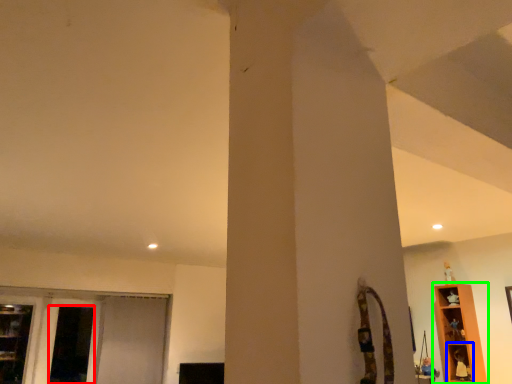
Question: Estimate the real-world distances between objects in this image. Which object is farther from screen door (highlighted by a red box), shelf (highlighted by a blue box) or shelf (highlighted by a green box)?

Choices:
 (A) shelf
 (B) shelf

Answer: (A)